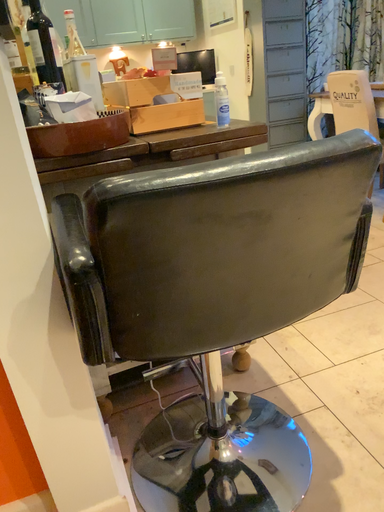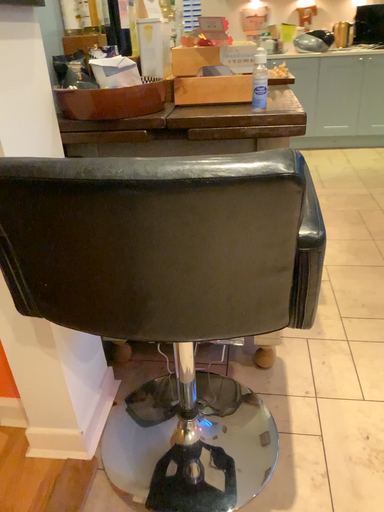
Question: How did the camera likely rotate when shooting the video?

Choices:
 (A) rotated left
 (B) rotated right

Answer: (A)